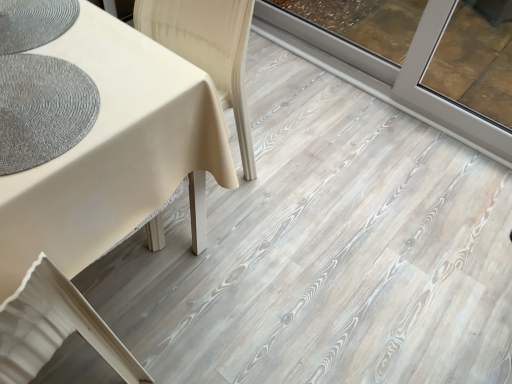
The image size is (512, 384). I want to click on textured gray mat at left, so click(x=42, y=109).

Image resolution: width=512 pixels, height=384 pixels. Describe the element at coordinates (42, 109) in the screenshot. I see `textured gray mat at left` at that location.

Measure the distance between textured gray mat at left and camera.

textured gray mat at left is 28.50 inches from camera.

Locate an element on the screen. This screenshot has height=384, width=512. white matte swivel chair at lower left is located at coordinates (54, 327).

The image size is (512, 384). Describe the element at coordinates (54, 327) in the screenshot. I see `white matte swivel chair at lower left` at that location.

Measure the distance between white matte swivel chair at lower left and camera.

25.12 inches.

Identify the location of textured gray mat at left. The image size is (512, 384). (42, 109).

Between textured gray mat at left and white matte swivel chair at lower left, which one appears on the left side from the viewer's perspective?

Positioned to the left is white matte swivel chair at lower left.

Based on the photo, does textured gray mat at left come in front of white matte swivel chair at lower left?

Result: No, textured gray mat at left is further to the viewer.

Is point (74, 103) closer to camera compared to point (111, 340)?

Yes, point (74, 103) is in front of point (111, 340).

From the image's perspective, who appears lower, textured gray mat at left or white matte swivel chair at lower left?

white matte swivel chair at lower left is shown below in the image.

From a real-world perspective, which object stands above the other?

textured gray mat at left is physically above.

Is textured gray mat at left wider than white matte swivel chair at lower left?

Answer: No, textured gray mat at left is not wider than white matte swivel chair at lower left.

In terms of height, does textured gray mat at left look taller or shorter compared to white matte swivel chair at lower left?

In the image, textured gray mat at left appears to be shorter than white matte swivel chair at lower left.

Considering the sizes of objects textured gray mat at left and white matte swivel chair at lower left in the image provided, who is smaller, textured gray mat at left or white matte swivel chair at lower left?

textured gray mat at left is smaller.

Looking at this image, is white matte swivel chair at lower left surrounded by textured gray mat at left?

No, white matte swivel chair at lower left is located outside of textured gray mat at left.

Is there a large distance between textured gray mat at left and white matte swivel chair at lower left?

No, there isn't a large distance between textured gray mat at left and white matte swivel chair at lower left.

Is textured gray mat at left oriented towards white matte swivel chair at lower left?

No, textured gray mat at left does not turn towards white matte swivel chair at lower left.

From the picture: Can you tell me how much textured gray mat at left and white matte swivel chair at lower left differ in facing direction?

textured gray mat at left and white matte swivel chair at lower left are facing 179 degrees away from each other.

The width and height of the screenshot is (512, 384). I want to click on swivel chair below the textured gray mat at left (from a real-world perspective), so click(54, 327).

Which object is positioned more to the left, white matte swivel chair at lower left or textured gray mat at left?

white matte swivel chair at lower left is more to the left.

Which object is further away from the camera taking this photo, white matte swivel chair at lower left or textured gray mat at left?

textured gray mat at left.

Considering the points (32, 316) and (87, 77), which point is in front, point (32, 316) or point (87, 77)?

The point (32, 316) is more forward.

From the image's perspective, is white matte swivel chair at lower left above textured gray mat at left?

Incorrect, from the image's perspective, white matte swivel chair at lower left is lower than textured gray mat at left.

From a real-world perspective, which is physically above, white matte swivel chair at lower left or textured gray mat at left?

From a 3D spatial view, textured gray mat at left is above.

Does white matte swivel chair at lower left have a greater width compared to textured gray mat at left?

Indeed, white matte swivel chair at lower left has a greater width compared to textured gray mat at left.

Is white matte swivel chair at lower left taller or shorter than textured gray mat at left?

Considering their sizes, white matte swivel chair at lower left has more height than textured gray mat at left.

Can you confirm if white matte swivel chair at lower left is bigger than textured gray mat at left?

Yes, white matte swivel chair at lower left is bigger than textured gray mat at left.

Is white matte swivel chair at lower left spatially inside textured gray mat at left, or outside of it?

white matte swivel chair at lower left is located beyond the bounds of textured gray mat at left.

Are white matte swivel chair at lower left and textured gray mat at left located far from each other?

No, white matte swivel chair at lower left is in close proximity to textured gray mat at left.

Is white matte swivel chair at lower left aimed at textured gray mat at left?

No, white matte swivel chair at lower left is not turned towards textured gray mat at left.

What's the angular difference between white matte swivel chair at lower left and textured gray mat at left's facing directions?

179 degrees.

Locate an element on the screen. The width and height of the screenshot is (512, 384). swivel chair below the textured gray mat at left (from a real-world perspective) is located at coordinates (54, 327).

There is a white matte swivel chair at lower left. Identify the location of mat above it (from a real-world perspective). The width and height of the screenshot is (512, 384). [42, 109].

Image resolution: width=512 pixels, height=384 pixels. Find the location of `swivel chair on the left of textured gray mat at left`. swivel chair on the left of textured gray mat at left is located at coordinates (54, 327).